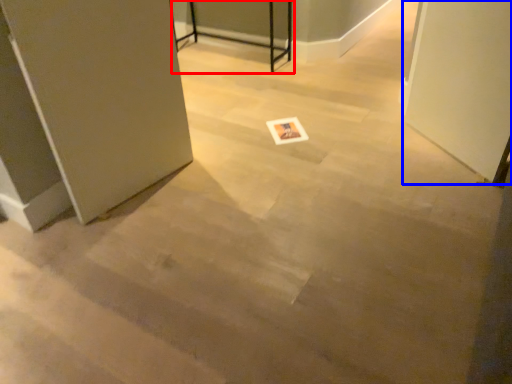
Question: Which object is further to the camera taking this photo, table (highlighted by a red box) or screen door (highlighted by a blue box)?

Choices:
 (A) table
 (B) screen door

Answer: (A)